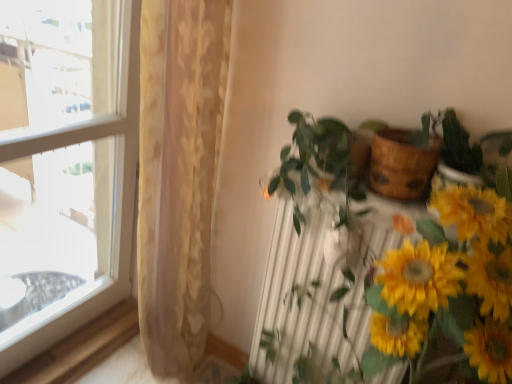
Question: From the image's perspective, is transparent glass window at left located above or below white metallic radiator at center?

Choices:
 (A) above
 (B) below

Answer: (A)

Question: From their relative heights in the image, would you say transparent glass window at left is taller or shorter than white metallic radiator at center?

Choices:
 (A) tall
 (B) short

Answer: (A)

Question: Estimate the real-world distances between objects in this image. Which object is closer to the yellow matte sunflowers at lower right?

Choices:
 (A) green glossy plant at center
 (B) white metallic radiator at center
 (C) wooden at upper right
 (D) translucent beige curtain at left
 (E) transparent glass window at left

Answer: (A)

Question: Based on their relative distances, which object is nearer to the translucent beige curtain at left?

Choices:
 (A) white metallic radiator at center
 (B) green glossy plant at center
 (C) yellow matte sunflowers at lower right
 (D) wooden at upper right
 (E) transparent glass window at left

Answer: (A)